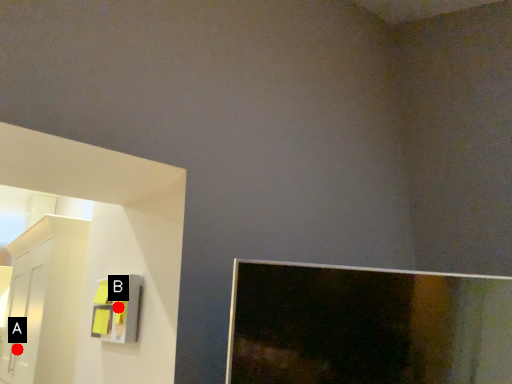
Question: Two points are circled on the image, labeled by A and B beside each circle. Which point is closer to the camera?

Choices:
 (A) A is closer
 (B) B is closer

Answer: (B)